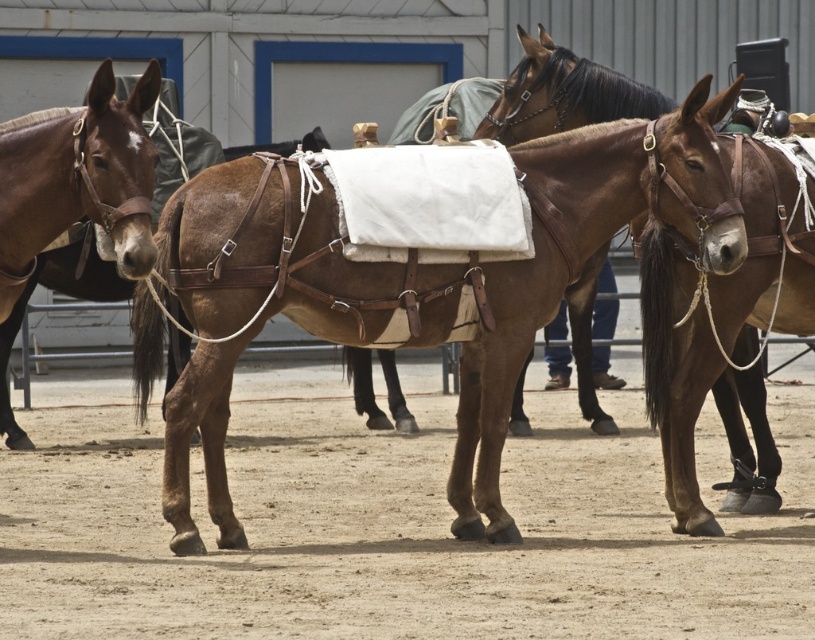
Question: Does brown leather saddle at center appear over brown leather horse at center?

Choices:
 (A) yes
 (B) no

Answer: (B)

Question: Is brown leather saddle at center to the right of brown leather harness at left from the viewer's perspective?

Choices:
 (A) yes
 (B) no

Answer: (A)

Question: Which point appears closest to the camera in this image?

Choices:
 (A) (98, 177)
 (B) (483, 356)

Answer: (A)

Question: Which object is the farthest from the brown leather saddle at center?

Choices:
 (A) brown leather harness at left
 (B) brown leather horse at center

Answer: (B)

Question: Among these points, which one is farthest from the camera?

Choices:
 (A) (358, 300)
 (B) (602, 84)
 (C) (84, 177)

Answer: (B)

Question: Is brown leather saddle at center above brown leather harness at left?

Choices:
 (A) yes
 (B) no

Answer: (B)